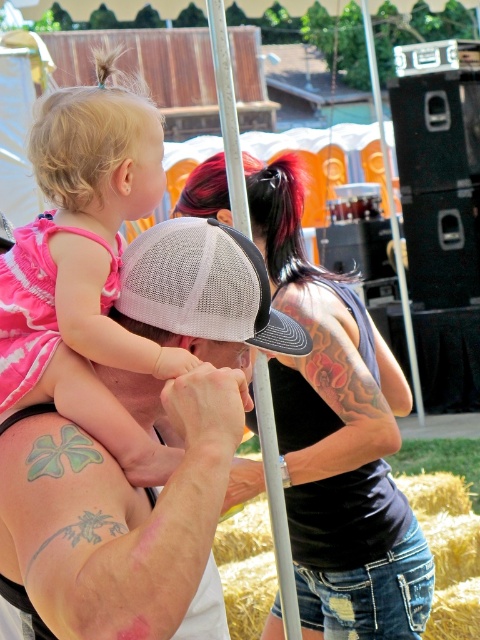
You are setting up a photo shoot and need to place a 1.2 meter wide backdrop between the rusty straw bale at lower right and the silver metallic pole at center. Will the backdrop fit between them?

The rusty straw bale at lower right is wider than the silver metallic pole at center. Since the backdrop is 1.2 meters wide, it may not fit if the space between them is narrower than 1.2 meters. However, the description only states the width comparison between the objects, not the distance between them. Therefore, we cannot determine if the backdrop will fit based on the given information.

You are a photographer trying to capture a photo of the pink fabric dress at upper left and the white mesh baseball cap at center. Which object should you zoom in on to make them appear the same size in the photo?

The pink fabric dress at upper left is bigger than the white mesh baseball cap at center, so you should zoom in more on the white mesh baseball cap at center to make them appear the same size in the photo.